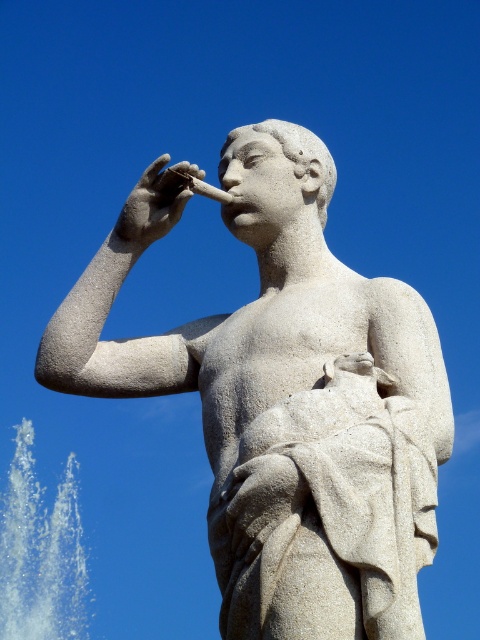
You are standing in a park and see the white stone statue at center. If you want to take a photo of it from a distance where it appears small in the frame, should you move closer or farther away?

The white stone statue at center is 183.11 feet from viewer. To make it appear small in the frame, you should move farther away from the statue.

You are a construction worker standing at the base of the white stone statue at center. You need to reach the white stone hand at upper center to secure a safety harness. Given that your ladder can extend up to 10 meters, will it be long enough to reach the hand?

The white stone statue at center is 10.96 meters from the white stone hand at upper center. Since the ladder can only extend up to 10 meters, it is not long enough to reach the hand.

You are an art conservator examining the statue. You notice the white vapor at lower left and the white stone hand at upper center. Which object is positioned to the left of the other?

The white vapor at lower left is to the left of the white stone hand at upper center.